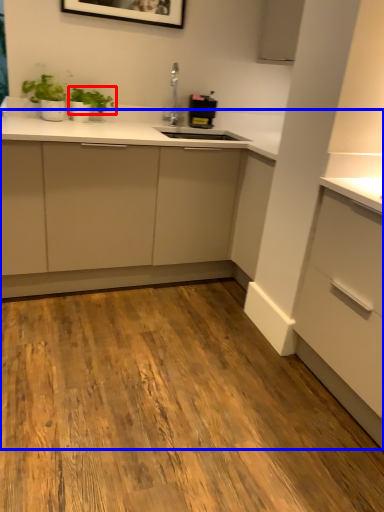
Question: Which object is further to the camera taking this photo, plant (highlighted by a red box) or dresser (highlighted by a blue box)?

Choices:
 (A) plant
 (B) dresser

Answer: (A)